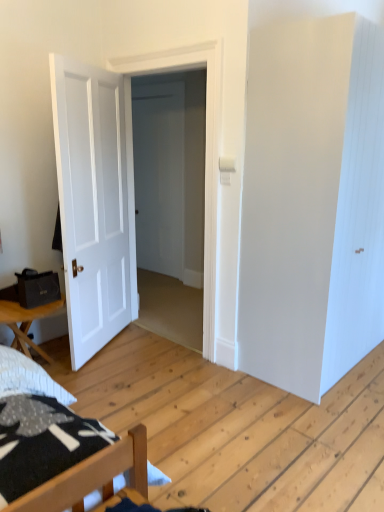
You are a GUI agent. You are given a task and a screenshot of the screen. Output one action in this format:
    pyautogui.click(x=<x>, y=<y>)
    Task: Click on the white matte door at left, arranged as the second door when viewed from the right
    
    Given the screenshot: What is the action you would take?
    pyautogui.click(x=94, y=202)

Describe the element at coordinates (27, 323) in the screenshot. I see `wooden table at lower left` at that location.

In order to click on wooden table at lower left in this screenshot , I will do `click(27, 323)`.

Find the location of `white smooth door at center, the 2th door from the left`. white smooth door at center, the 2th door from the left is located at coordinates (206, 147).

From a real-world perspective, which object stands above the other?

white smooth door at center, the first door when ordered from right to left, is physically above.

Locate an element on the screen. table lying below the white smooth door at center, the 2th door from the left (from the image's perspective) is located at coordinates (27, 323).

In the scene shown: Which of these two, white smooth door at center, the 2th door from the left, or wooden table at lower left, is wider?

With larger width is wooden table at lower left.

Does white smooth door at center, the first door when ordered from right to left, have a greater height compared to wooden table at lower left?

Indeed, white smooth door at center, the first door when ordered from right to left, has a greater height compared to wooden table at lower left.

Considering the positions of point (69, 67) and point (213, 281), is point (69, 67) closer or farther from the camera than point (213, 281)?

Point (69, 67) appears to be closer to the viewer than point (213, 281).

Could you tell me if white matte door at left, arranged as the second door when viewed from the right, is facing white smooth door at center, the first door when ordered from right to left?

Yes, white matte door at left, arranged as the second door when viewed from the right, is turned towards white smooth door at center, the first door when ordered from right to left.

Is white matte door at left, which appears as the first door when viewed from the left, closer to camera compared to white smooth door at center, the first door when ordered from right to left?

Yes, white matte door at left, which appears as the first door when viewed from the left, is in front of white smooth door at center, the first door when ordered from right to left.

Is white matte door at left, arranged as the second door when viewed from the right, to the left of white smooth door at center, the first door when ordered from right to left, from the viewer's perspective?

Indeed, white matte door at left, arranged as the second door when viewed from the right, is positioned on the left side of white smooth door at center, the first door when ordered from right to left.

Is wooden table at lower left positioned beyond the bounds of white smooth door at center, the first door when ordered from right to left?

Indeed, wooden table at lower left is completely outside white smooth door at center, the first door when ordered from right to left.

Looking at this image, considering the sizes of objects wooden table at lower left and white smooth door at center, the first door when ordered from right to left, in the image provided, who is thinner, wooden table at lower left or white smooth door at center, the first door when ordered from right to left,?

white smooth door at center, the first door when ordered from right to left.

Based on their sizes in the image, would you say white smooth door at center, the first door when ordered from right to left, is bigger or smaller than white matte door at left, arranged as the second door when viewed from the right?

white smooth door at center, the first door when ordered from right to left, is bigger than white matte door at left, arranged as the second door when viewed from the right.

Does white smooth door at center, the 2th door from the left, have a lesser width compared to white matte door at left, arranged as the second door when viewed from the right?

Incorrect, the width of white smooth door at center, the 2th door from the left, is not less than that of white matte door at left, arranged as the second door when viewed from the right.

Is white smooth door at center, the 2th door from the left, facing away from white matte door at left, which appears as the first door when viewed from the left?

Yes, white smooth door at center, the 2th door from the left, is facing away from white matte door at left, which appears as the first door when viewed from the left.

At what (x,y) coordinates should I click in order to perform the action: click on table beneath the white matte door at left, arranged as the second door when viewed from the right (from a real-world perspective). Please return your answer as a coordinate pair (x, y). Image resolution: width=384 pixels, height=512 pixels. Looking at the image, I should click on (27, 323).

Considering the relative sizes of wooden table at lower left and white matte door at left, arranged as the second door when viewed from the right, in the image provided, is wooden table at lower left thinner than white matte door at left, arranged as the second door when viewed from the right,?

No.

Based on their sizes in the image, would you say wooden table at lower left is bigger or smaller than white matte door at left, arranged as the second door when viewed from the right?

In the image, wooden table at lower left appears to be smaller than white matte door at left, arranged as the second door when viewed from the right.

Does white matte door at left, which appears as the first door when viewed from the left, have a smaller size compared to wooden table at lower left?

No.

Can you tell me how much white matte door at left, which appears as the first door when viewed from the left, and wooden table at lower left differ in facing direction?

The angle between the facing direction of white matte door at left, which appears as the first door when viewed from the left, and the facing direction of wooden table at lower left is 28.8 degrees.

Is white matte door at left, which appears as the first door when viewed from the left, wider than wooden table at lower left?

Incorrect, the width of white matte door at left, which appears as the first door when viewed from the left, does not surpass that of wooden table at lower left.

At what (x,y) coordinates should I click in order to perform the action: click on the 2nd door to the right when counting from the wooden table at lower left. Please return your answer as a coordinate pair (x, y). The width and height of the screenshot is (384, 512). Looking at the image, I should click on (206, 147).

Locate an element on the screen. door that is above the white matte door at left, which appears as the first door when viewed from the left (from a real-world perspective) is located at coordinates (x=206, y=147).

Which object lies further to the anchor point white matte door at left, which appears as the first door when viewed from the left, wooden table at lower left or white smooth door at center, the first door when ordered from right to left?

wooden table at lower left is further to white matte door at left, which appears as the first door when viewed from the left.

When comparing their distances from white smooth door at center, the 2th door from the left, does wooden table at lower left or white matte door at left, which appears as the first door when viewed from the left, seem further?

wooden table at lower left is further to white smooth door at center, the 2th door from the left.

From the image, which object appears to be farther from wooden table at lower left, white matte door at left, which appears as the first door when viewed from the left, or white smooth door at center, the 2th door from the left?

Based on the image, white smooth door at center, the 2th door from the left, appears to be further to wooden table at lower left.

From the image, which object appears to be farther from wooden table at lower left, white smooth door at center, the 2th door from the left, or white matte door at left, arranged as the second door when viewed from the right?

Based on the image, white smooth door at center, the 2th door from the left, appears to be further to wooden table at lower left.

When comparing their distances from white matte door at left, arranged as the second door when viewed from the right, does white smooth door at center, the first door when ordered from right to left, or wooden table at lower left seem closer?

Based on the image, white smooth door at center, the first door when ordered from right to left, appears to be nearer to white matte door at left, arranged as the second door when viewed from the right.

Considering their positions, is white matte door at left, which appears as the first door when viewed from the left, positioned closer to white smooth door at center, the 2th door from the left, than wooden table at lower left?

Among the two, white matte door at left, which appears as the first door when viewed from the left, is located nearer to white smooth door at center, the 2th door from the left.

Locate an element on the screen. Image resolution: width=384 pixels, height=512 pixels. door between white smooth door at center, the first door when ordered from right to left, and wooden table at lower left from top to bottom is located at coordinates (94, 202).